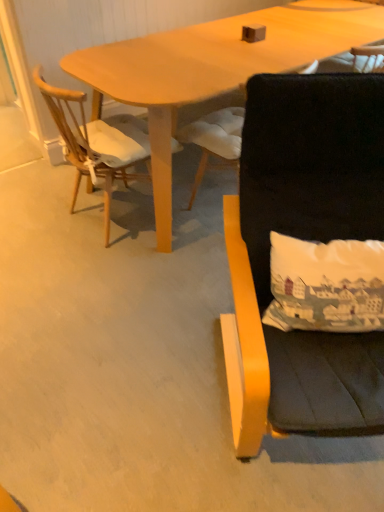
Image resolution: width=384 pixels, height=512 pixels. I want to click on free point in front of black fabric chair at center, which is the second chair in right-to-left order, so click(194, 261).